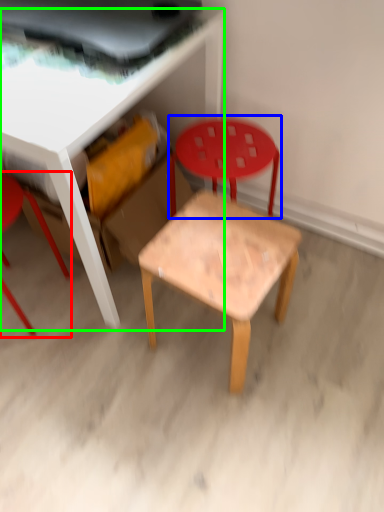
Question: Which object is the farthest from chair (highlighted by a red box)? Choose among these: chair (highlighted by a blue box) or table (highlighted by a green box).

Choices:
 (A) chair
 (B) table

Answer: (A)